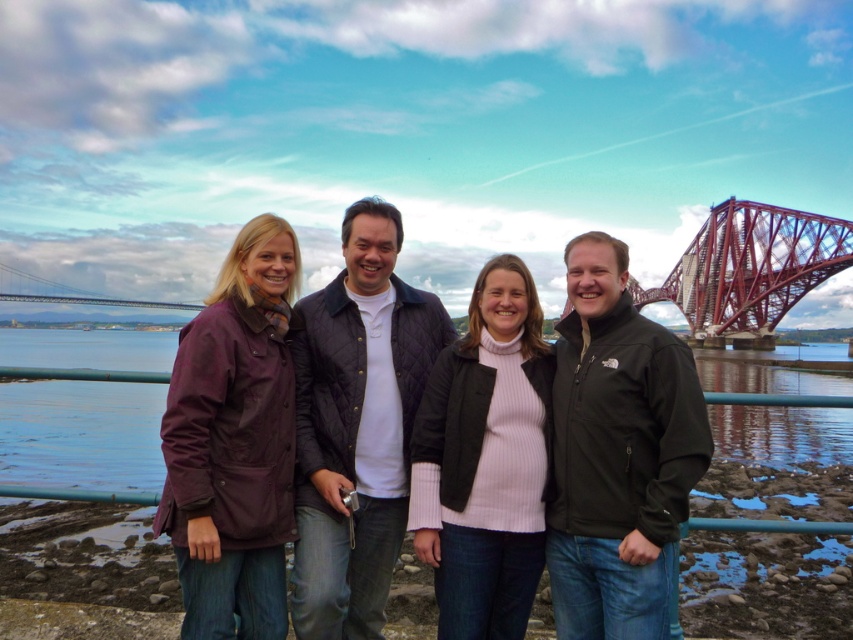
Between matte purple jacket at center and red metal bridge at upper right, which one is positioned lower?

matte purple jacket at center is lower down.

Does matte purple jacket at center appear under red metal bridge at upper right?

Indeed, matte purple jacket at center is positioned under red metal bridge at upper right.

Locate an element on the screen. The height and width of the screenshot is (640, 853). matte purple jacket at center is located at coordinates (370, 424).

You are a GUI agent. You are given a task and a screenshot of the screen. Output one action in this format:
    pyautogui.click(x=<x>, y=<y>)
    Task: Click on the matte purple jacket at center
    
    Given the screenshot: What is the action you would take?
    pyautogui.click(x=370, y=424)